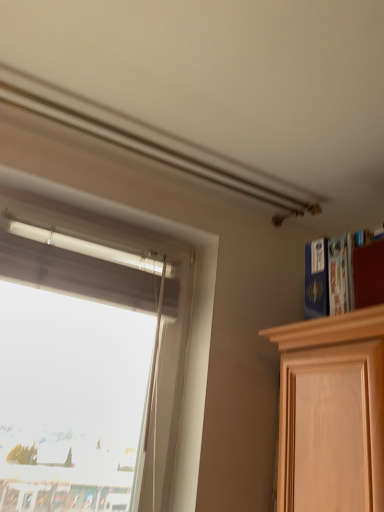
You are a GUI agent. You are given a task and a screenshot of the screen. Output one action in this format:
    pyautogui.click(x=<x>, y=<y>)
    Task: Click on the translucent fabric at left
    
    Given the screenshot: What is the action you would take?
    (x=82, y=360)

What do you see at coordinates (82, 360) in the screenshot? This screenshot has width=384, height=512. I see `translucent fabric at left` at bounding box center [82, 360].

Where is `translucent fabric at left`? Image resolution: width=384 pixels, height=512 pixels. translucent fabric at left is located at coordinates (82, 360).